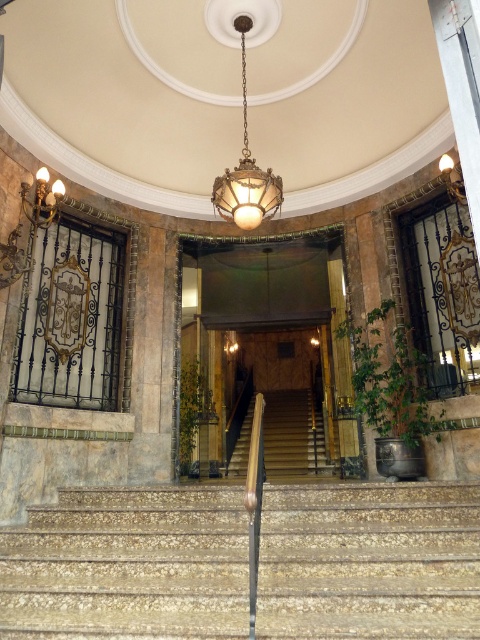
You are an interior designer planning to place a large sculpture that requires a wide base. Based on the scene, which object between the stone textured stairs at center and the metallic brass lamp at upper right has a larger width to accommodate the sculpture?

The stone textured stairs at center has a larger width compared to the metallic brass lamp at upper right, making it suitable for placing the sculpture with a wide base.

Consider the image. You are standing at the base of the staircase and notice the stone textured stairs at center and the metallic brass lamp at upper right. Which object is located to the right when facing the staircase?

The metallic brass lamp at upper right is located to the right of the stone textured stairs at center.